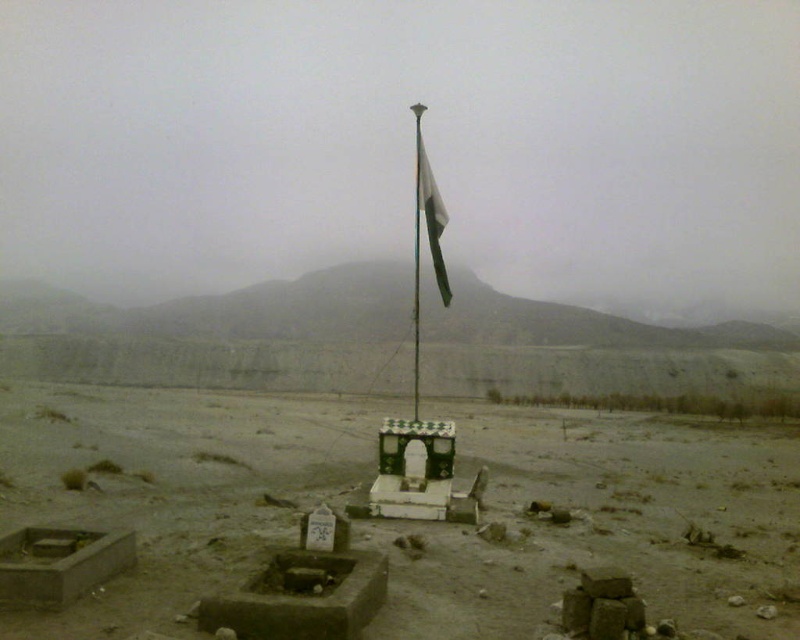
You are a photographer wanting to capture the metallic flag pole at center and the dull brown dirt field at center in a single frame. Given their sizes, which object should you focus on to ensure both are visible without needing to zoom in or out excessively?

The metallic flag pole at center is larger than the dull brown dirt field at center, so focusing on the metallic flag pole at center would allow both to be visible without excessive zoom adjustments.

You are a photographer trying to capture the entire view of both the white glossy flag pole at center and the metallic flag pole at center in a single shot. Based on their heights, which flag pole might require you to adjust your camera angle to ensure it is fully visible?

The white glossy flag pole at center is shorter than the metallic flag pole at center, so the metallic flag pole at center may require adjusting the camera angle to ensure it is fully visible in the photo.